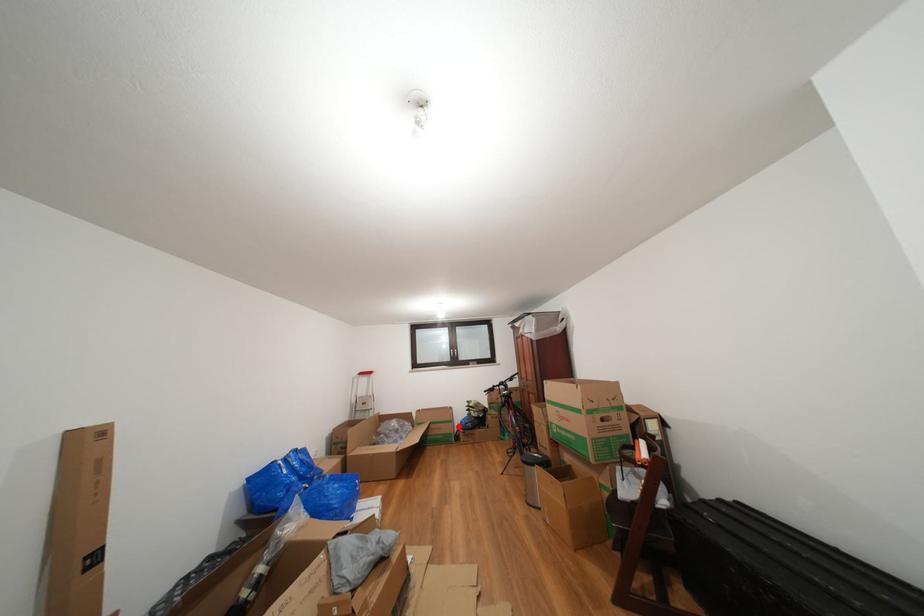
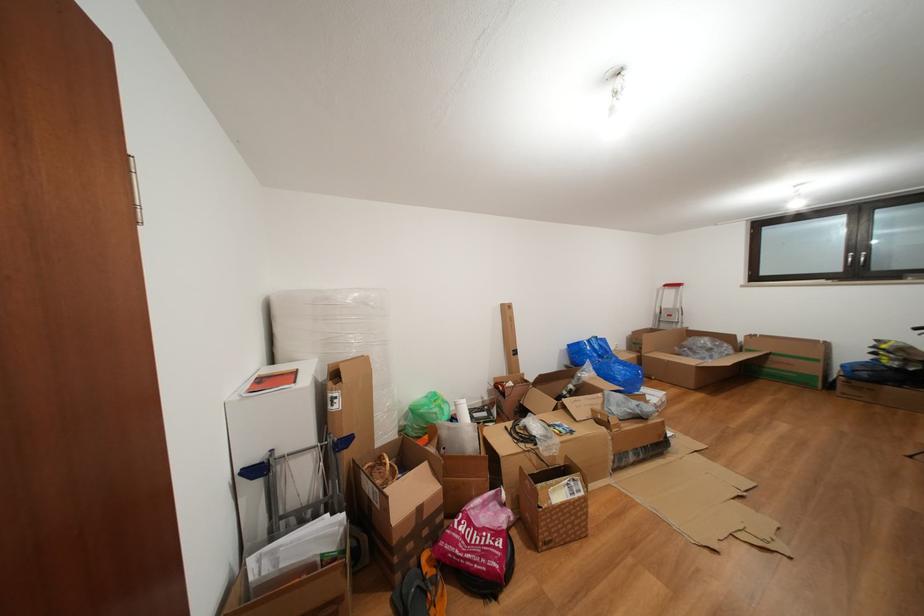
The point at the highlighted location is marked in the first image. Where is the corresponding point in the second image?

(824, 366)